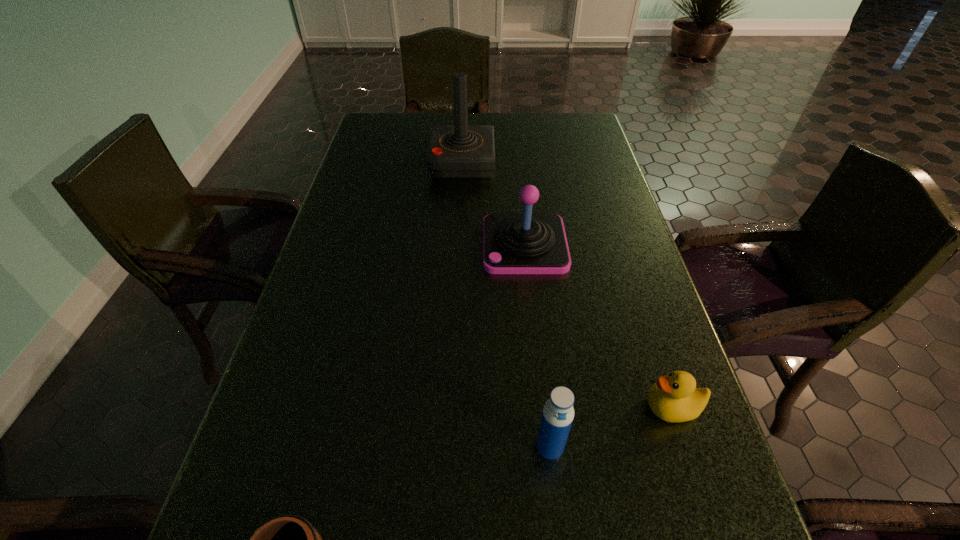
Image resolution: width=960 pixels, height=540 pixels. I want to click on empty space that is in between the taller joystick and the rightmost object, so click(567, 285).

This screenshot has height=540, width=960. I want to click on vacant area that lies between the nearer joystick and the third farthest object, so click(x=598, y=326).

Locate an element on the screen. This screenshot has width=960, height=540. empty space between the water bottle and the rightmost object is located at coordinates (612, 427).

At what (x,y) coordinates should I click in order to perform the action: click on vacant space that's between the nearer joystick and the water bottle. Please return your answer as a coordinate pair (x, y). Looking at the image, I should click on (538, 346).

In order to click on free space that is in between the shorter joystick and the rightmost object in this screenshot , I will do `click(598, 326)`.

Locate an element on the screen. This screenshot has height=540, width=960. free space between the farthest object and the nearer joystick is located at coordinates (493, 204).

Identify the location of free space between the farthest object and the rightmost object. Image resolution: width=960 pixels, height=540 pixels. (567, 285).

At what (x,y) coordinates should I click in order to perform the action: click on free space between the duck and the nearer joystick. Please return your answer as a coordinate pair (x, y). The image size is (960, 540). Looking at the image, I should click on (598, 326).

The height and width of the screenshot is (540, 960). I want to click on the fourth closest object to the fourth farthest object, so click(x=455, y=151).

Select which object is the second closest to the duck. Please provide its 2D coordinates. Your answer should be formatted as a tuple, i.e. [(x, y)], where the tuple contains the x and y coordinates of a point satisfying the conditions above.

[(513, 243)]